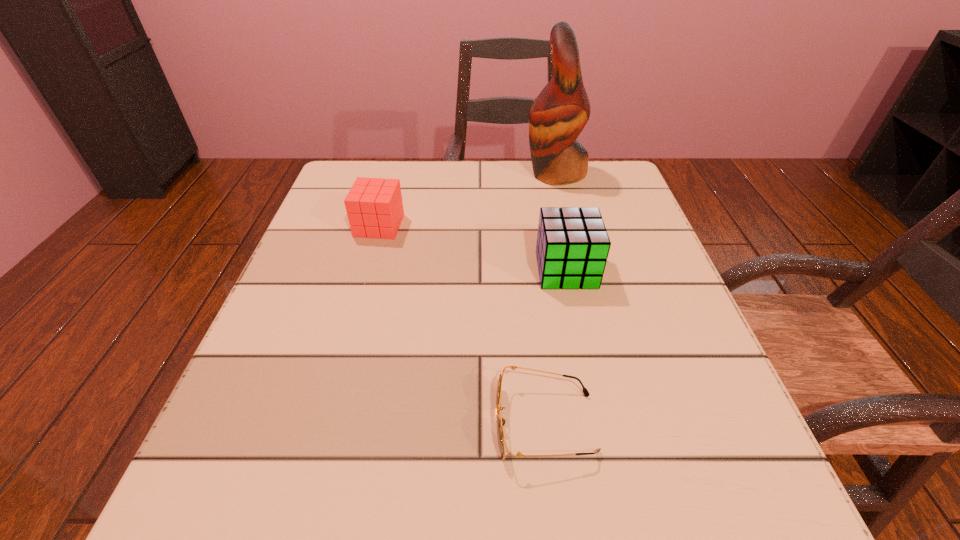
Find the location of `parrot`. parrot is located at coordinates (558, 115).

The image size is (960, 540). Identify the location of the farthest object. (558, 115).

You are a GUI agent. You are given a task and a screenshot of the screen. Output one action in this format:
    pyautogui.click(x=<x>, y=<y>)
    Task: Click on the taller cube
    The height and width of the screenshot is (540, 960).
    Given the screenshot: What is the action you would take?
    pyautogui.click(x=572, y=247)

Locate an element on the screen. This screenshot has height=540, width=960. the third shortest object is located at coordinates (572, 247).

Image resolution: width=960 pixels, height=540 pixels. I want to click on the shorter cube, so (374, 207).

In order to click on the leftmost object in this screenshot , I will do (374, 207).

Find the location of a particular element. the shortest object is located at coordinates (501, 422).

You are a GUI agent. You are given a task and a screenshot of the screen. Output one action in this format:
    pyautogui.click(x=<x>, y=<y>)
    Task: Click on the sunglasses
    
    Given the screenshot: What is the action you would take?
    pyautogui.click(x=501, y=422)

Identify the location of free space located 0.210m on the face of the farthest object. pos(441,173).

You are a GUI agent. You are given a task and a screenshot of the screen. Output one action in this format:
    pyautogui.click(x=<x>, y=<y>)
    Task: Click on the free space located on the face of the farthest object
    The image size is (960, 540).
    Given the screenshot: What is the action you would take?
    pyautogui.click(x=481, y=173)